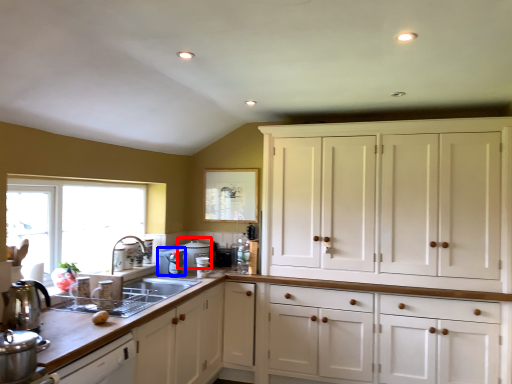
Question: Which object appears farthest to the camera in this image, appliance (highlighted by a red box) or appliance (highlighted by a blue box)?

Choices:
 (A) appliance
 (B) appliance

Answer: (A)